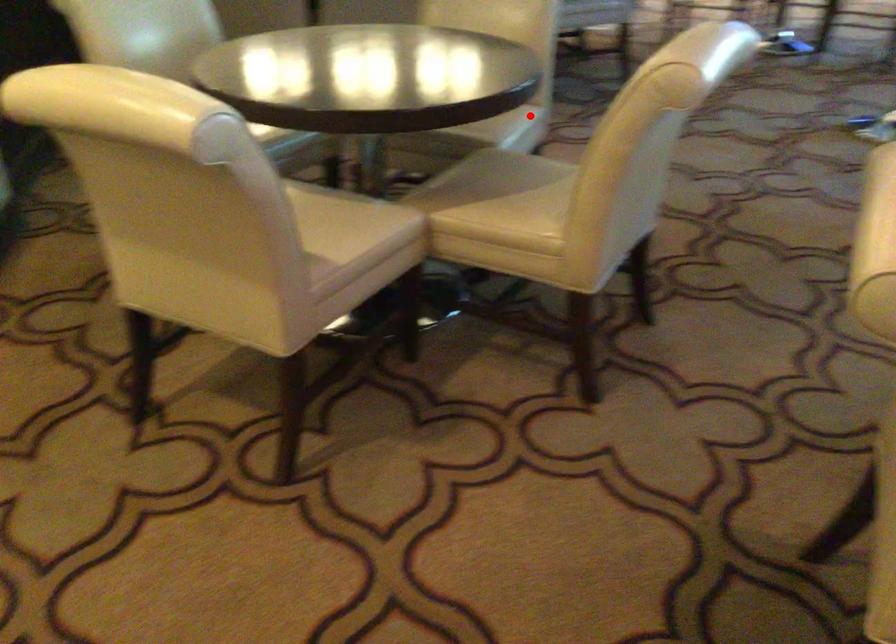
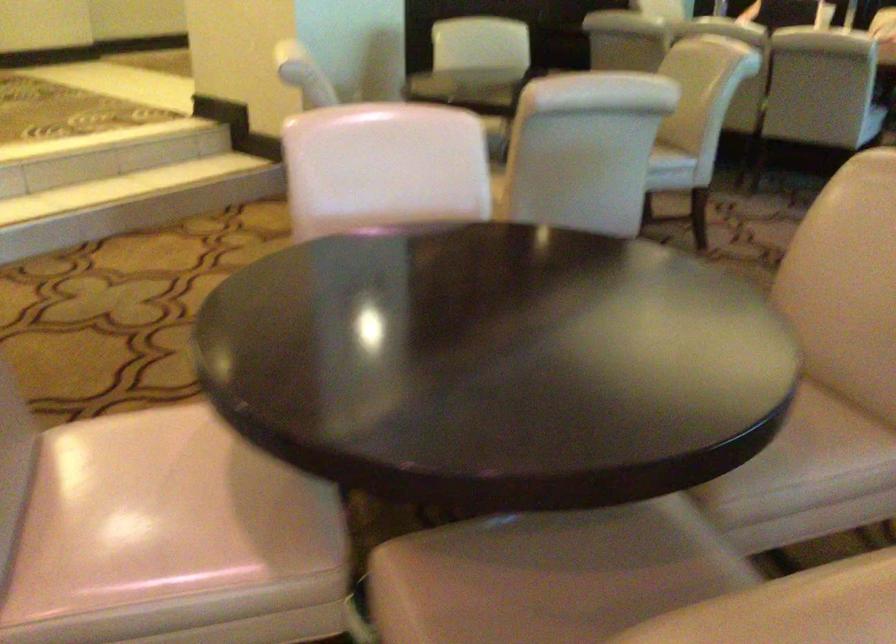
Find the pixel in the second image that matches the highlighted location in the first image.

(670, 163)